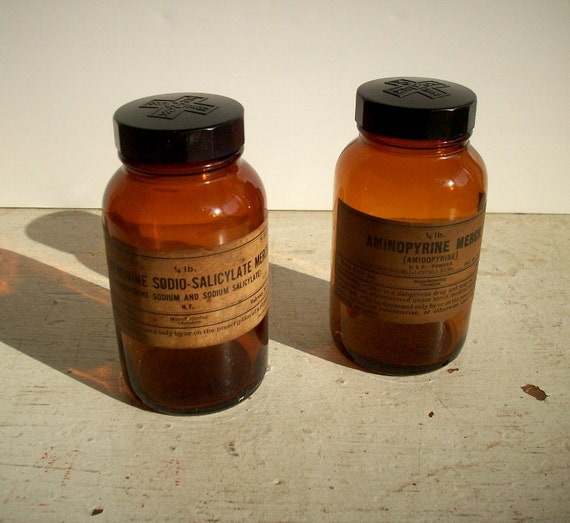
You are a GUI agent. You are given a task and a screenshot of the screen. Output one action in this format:
    pyautogui.click(x=<x>, y=<y>)
    Task: Click on the chip in shelf
    
    Given the screenshot: What is the action you would take?
    pyautogui.click(x=537, y=394)